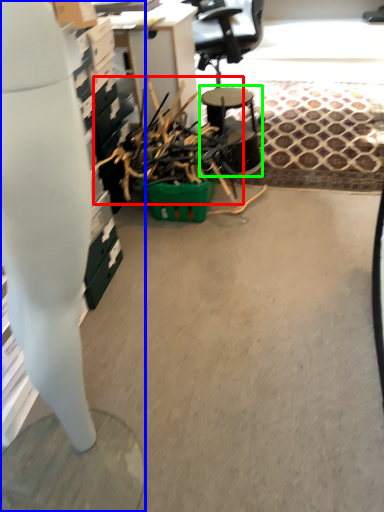
Question: Which is farther away from debris (highlighted by a red box)? desk (highlighted by a blue box) or round table (highlighted by a green box)?

Choices:
 (A) desk
 (B) round table

Answer: (A)